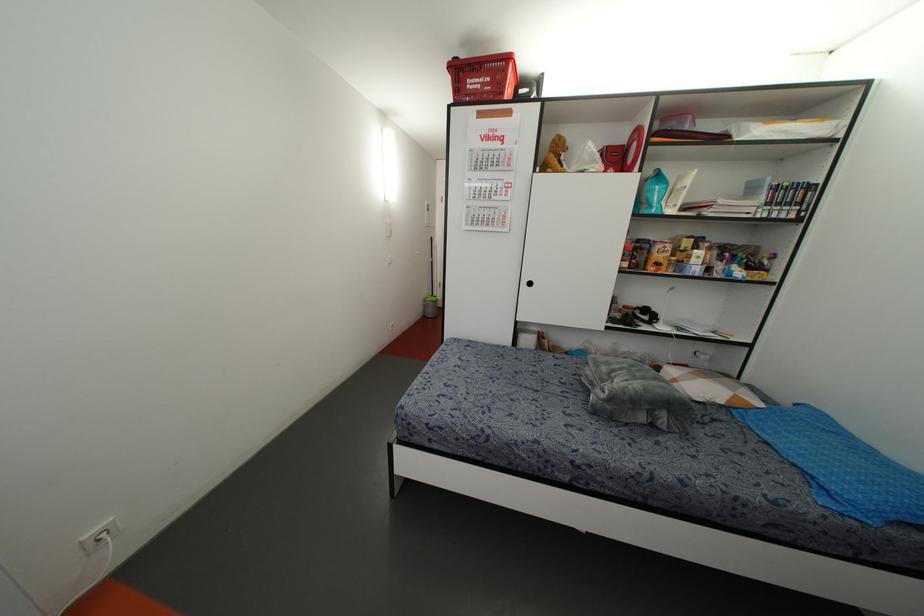
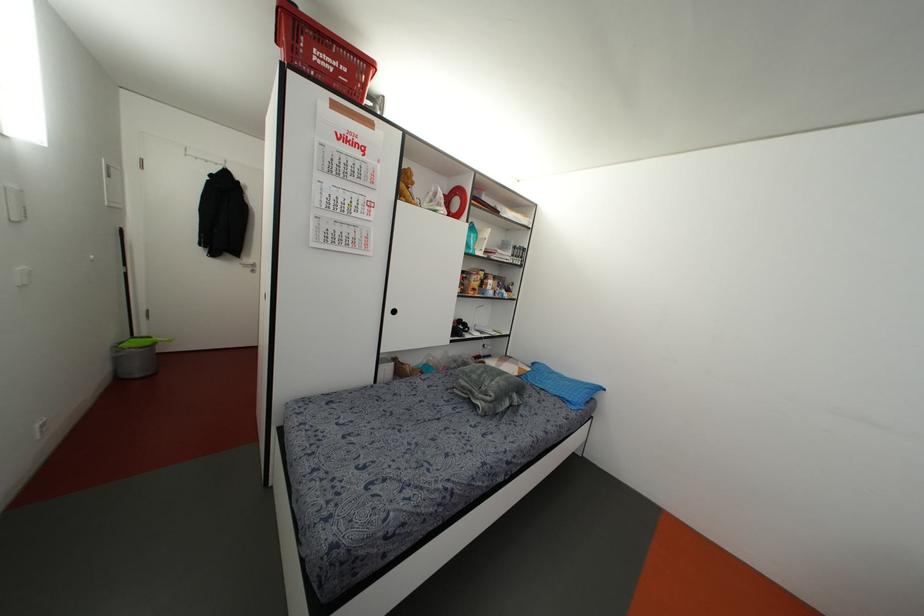
In the second image, find the point that corresponds to point 529,283 in the first image.

(394, 310)